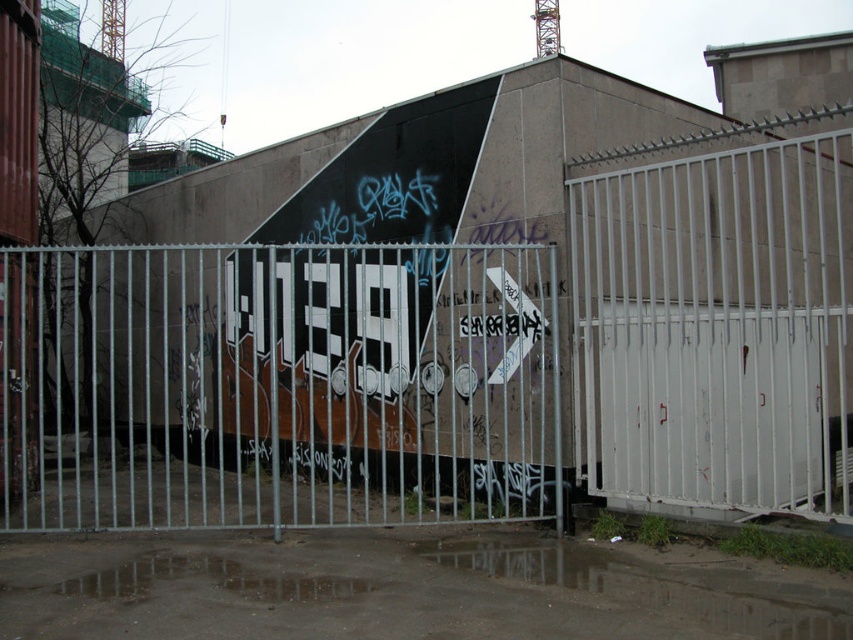
Question: Which point is farther to the camera?

Choices:
 (A) white metal gate at right
 (B) metallic silver gate at center

Answer: (A)

Question: Can you confirm if white metal fence at center is wider than metallic silver gate at center?

Choices:
 (A) no
 (B) yes

Answer: (B)

Question: Is white metal fence at center to the right of metallic silver gate at center from the viewer's perspective?

Choices:
 (A) no
 (B) yes

Answer: (B)

Question: Estimate the real-world distances between objects in this image. Which object is closer to the white metal gate at right?

Choices:
 (A) metallic silver gate at center
 (B) white metal fence at center

Answer: (B)

Question: Does metallic silver gate at center have a smaller size compared to white metal gate at right?

Choices:
 (A) no
 (B) yes

Answer: (A)

Question: Which point is farther to the camera?

Choices:
 (A) (805, 509)
 (B) (730, 275)

Answer: (B)